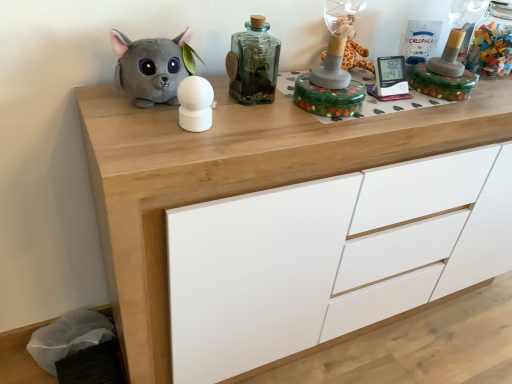
I want to click on unoccupied area in front of white matte sphere at center, which is the 2th toy from right to left, so (x=177, y=150).